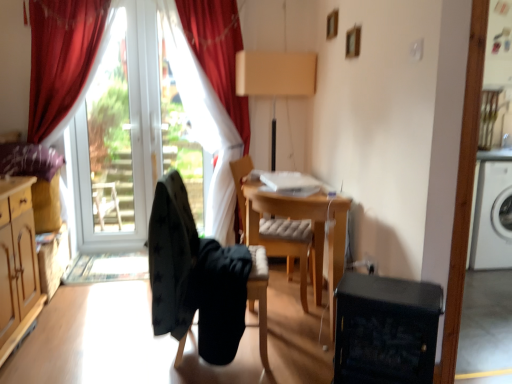
Question: From the image's perspective, relative to black plastic dishwasher at lower right, is red velvet curtain at left, which is the first curtain from left to right, above or below?

Choices:
 (A) above
 (B) below

Answer: (A)

Question: Is red velvet curtain at left, placed as the 2th curtain when sorted from right to left, taller or shorter than black plastic dishwasher at lower right?

Choices:
 (A) short
 (B) tall

Answer: (B)

Question: Based on their relative distances, which object is farther from the black fabric chair at center, arranged as the 2th chair when viewed from the back?

Choices:
 (A) white glass door at left
 (B) velvet red curtain at upper left, the 2th curtain when ordered from left to right
 (C) wooden desk at center
 (D) wooden cushioned chair at center, which is the 1th chair in back-to-front order
 (E) red velvet curtain at left, placed as the 2th curtain when sorted from right to left

Answer: (A)

Question: Estimate the real-world distances between objects in this image. Which object is farther from the wooden desk at center?

Choices:
 (A) red velvet curtain at left, placed as the 2th curtain when sorted from right to left
 (B) white glass door at left
 (C) velvet red curtain at upper left, which ranks as the 1th curtain in right-to-left order
 (D) black fabric chair at center, arranged as the 2th chair when viewed from the back
 (E) wooden cushioned chair at center, the second chair from the front

Answer: (B)